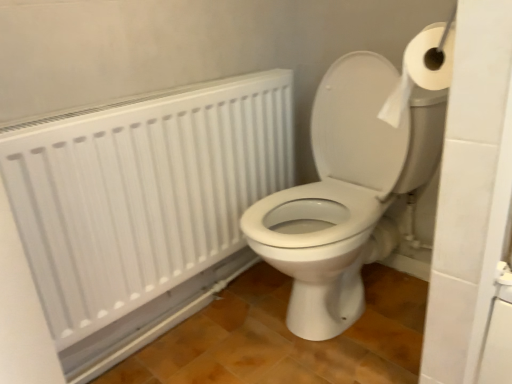
Question: From the image's perspective, is white matte radiator at upper left under white paper at upper right?

Choices:
 (A) no
 (B) yes

Answer: (B)

Question: From a real-world perspective, is white matte radiator at upper left physically above white paper at upper right?

Choices:
 (A) yes
 (B) no

Answer: (B)

Question: From the image's perspective, would you say white matte radiator at upper left is positioned over white paper at upper right?

Choices:
 (A) no
 (B) yes

Answer: (A)

Question: Is white matte radiator at upper left not close to white paper at upper right?

Choices:
 (A) yes
 (B) no

Answer: (B)

Question: Is white matte radiator at upper left thinner than white paper at upper right?

Choices:
 (A) no
 (B) yes

Answer: (B)

Question: From the image's perspective, is white paper at upper right positioned above or below white glossy toilet at center?

Choices:
 (A) above
 (B) below

Answer: (A)

Question: Considering the positions of point (426, 74) and point (342, 107), is point (426, 74) closer or farther from the camera than point (342, 107)?

Choices:
 (A) closer
 (B) farther

Answer: (A)

Question: From a real-world perspective, is white paper at upper right positioned above or below white glossy toilet at center?

Choices:
 (A) below
 (B) above

Answer: (B)

Question: Is white paper at upper right inside the boundaries of white glossy toilet at center, or outside?

Choices:
 (A) outside
 (B) inside

Answer: (A)

Question: From a real-world perspective, is white paper at upper right physically located above or below white matte radiator at upper left?

Choices:
 (A) below
 (B) above

Answer: (B)

Question: Is white paper at upper right in front of or behind white matte radiator at upper left in the image?

Choices:
 (A) behind
 (B) front

Answer: (B)

Question: From the image's perspective, relative to white matte radiator at upper left, is white paper at upper right above or below?

Choices:
 (A) above
 (B) below

Answer: (A)

Question: Based on their positions, is white paper at upper right located to the left or right of white matte radiator at upper left?

Choices:
 (A) left
 (B) right

Answer: (B)

Question: Considering the positions of white matte radiator at upper left and white paper at upper right in the image, is white matte radiator at upper left wider or thinner than white paper at upper right?

Choices:
 (A) wide
 (B) thin

Answer: (B)

Question: Is point 240,79 closer or farther from the camera than point 433,59?

Choices:
 (A) farther
 (B) closer

Answer: (A)